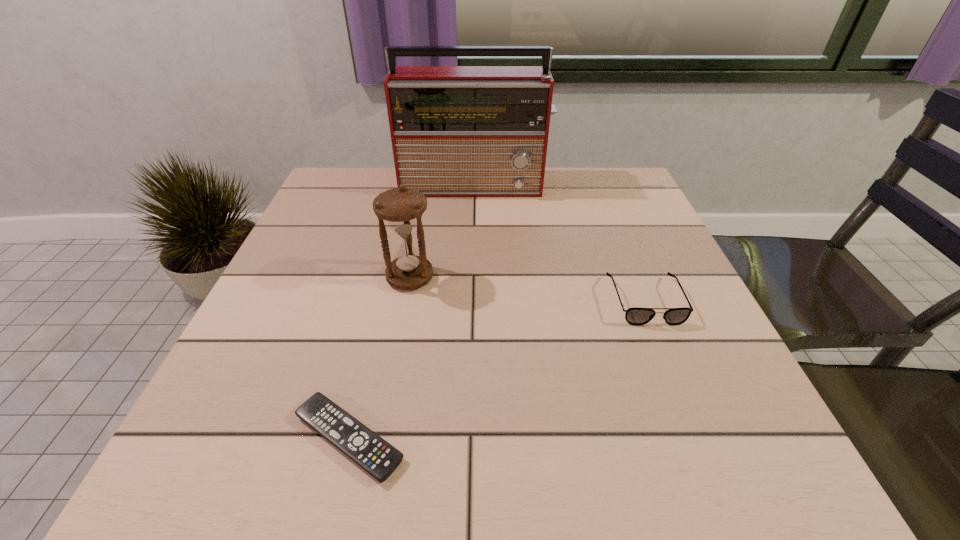
You are a GUI agent. You are given a task and a screenshot of the screen. Output one action in this format:
    pyautogui.click(x=<x>, y=<y>)
    Task: Click on the free point located 0.100m on the left of the remote control
    
    Given the screenshot: What is the action you would take?
    pyautogui.click(x=224, y=438)

Identify the location of object that is positioned at the far edge. The image size is (960, 540). (457, 131).

Find the location of a particular element. Image resolution: width=960 pixels, height=540 pixels. object positioned at the near edge is located at coordinates (376, 456).

Where is `object located at the left edge`? The image size is (960, 540). object located at the left edge is located at coordinates (376, 456).

The width and height of the screenshot is (960, 540). In order to click on object located at the right edge in this screenshot , I will do `click(638, 316)`.

Find the location of a particular element. object located in the near left corner section of the desktop is located at coordinates (376, 456).

This screenshot has height=540, width=960. In order to click on free space at the near edge of the desktop in this screenshot , I will do `click(542, 433)`.

This screenshot has width=960, height=540. What are the coordinates of `free space at the left edge` in the screenshot? It's located at (309, 248).

You are a GUI agent. You are given a task and a screenshot of the screen. Output one action in this format:
    pyautogui.click(x=<x>, y=<y>)
    Task: Click on the vacant space at the right edge of the desktop
    
    Given the screenshot: What is the action you would take?
    pyautogui.click(x=635, y=294)

I want to click on free space at the far left corner of the desktop, so click(x=319, y=188).